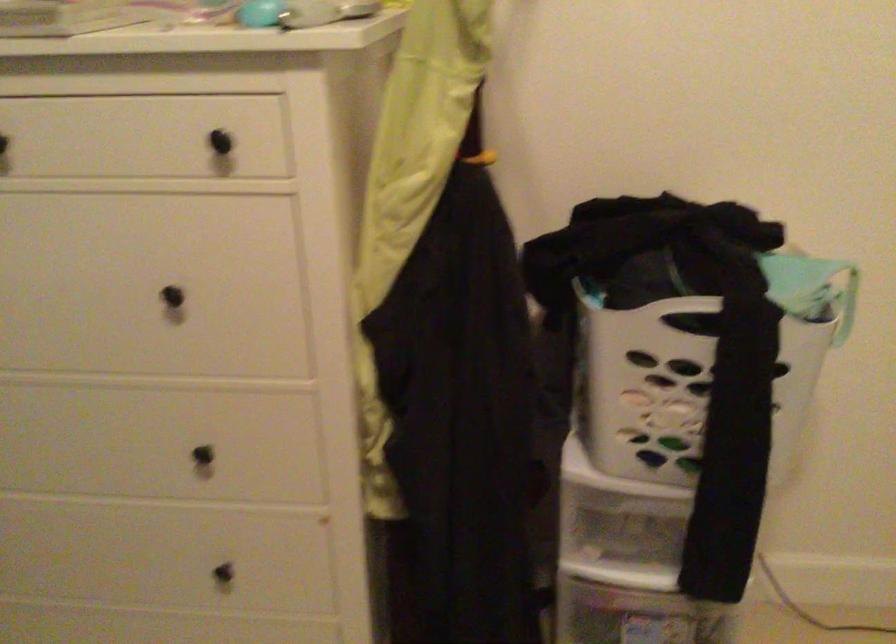
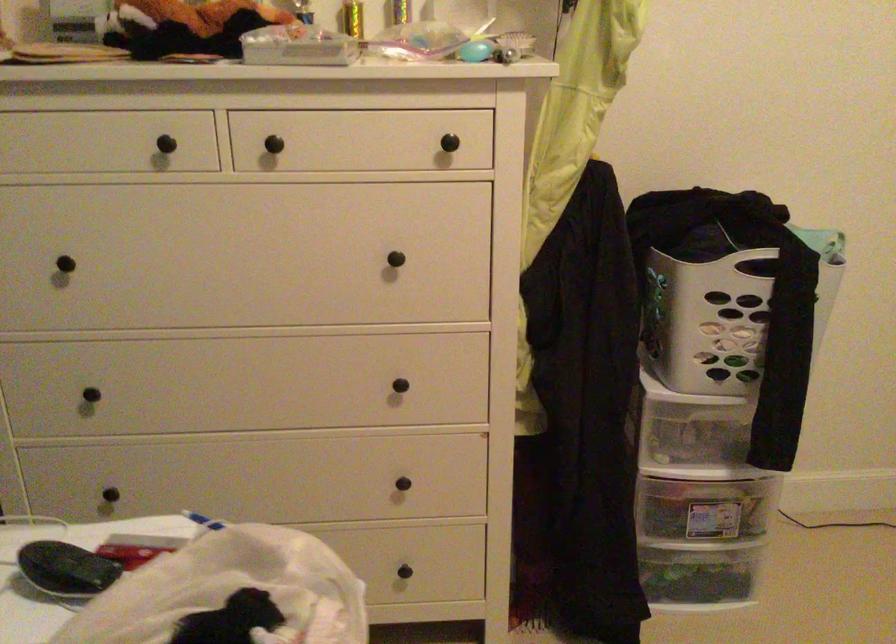
Where in the second image is the point corresponding to point 635,527 from the first image?

(695, 438)